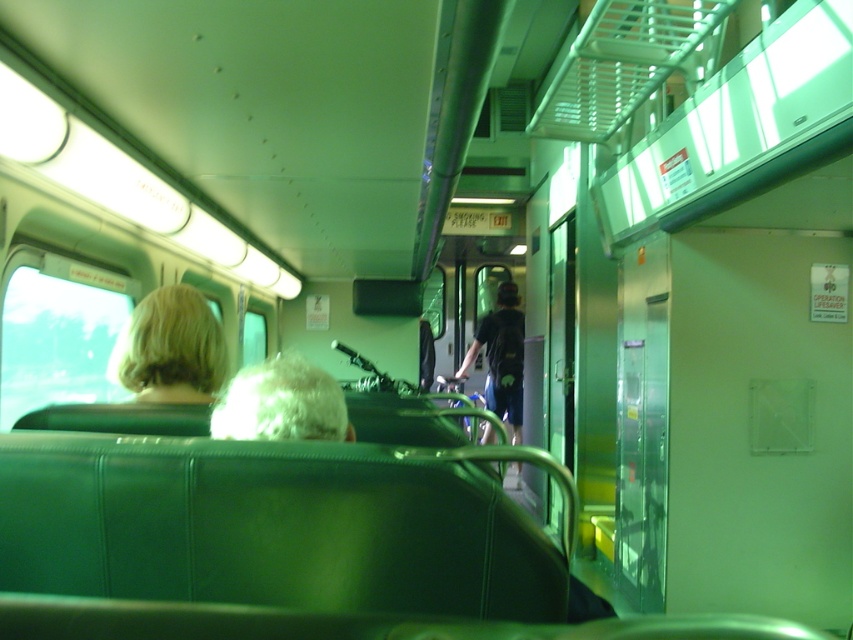
Is blonde hair at left further to the viewer compared to white curly hair at upper center?

Yes, blonde hair at left is further from the viewer.

Between blonde hair at left and white curly hair at upper center, which one is positioned lower?

white curly hair at upper center

Find the location of a particular element. This screenshot has width=853, height=640. blonde hair at left is located at coordinates pos(170,348).